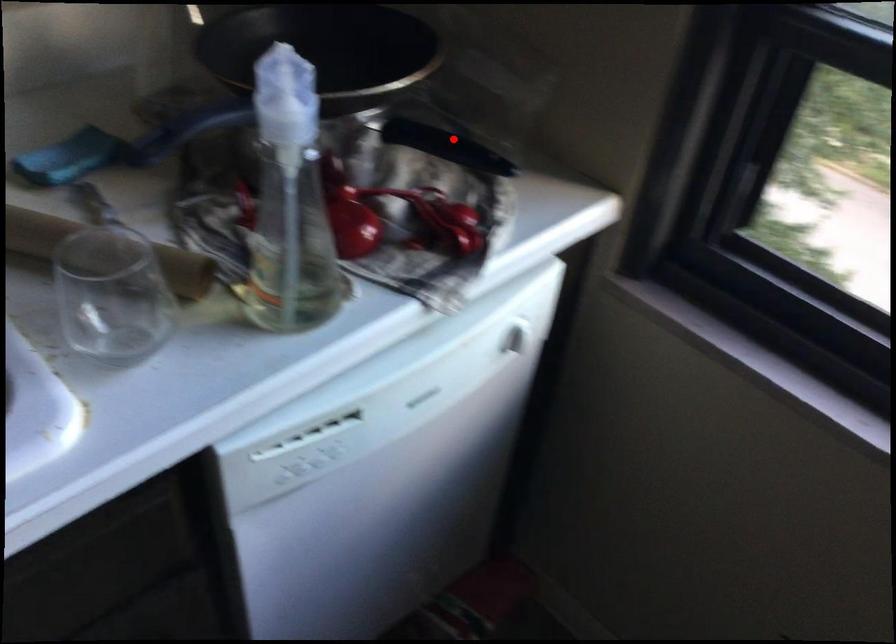
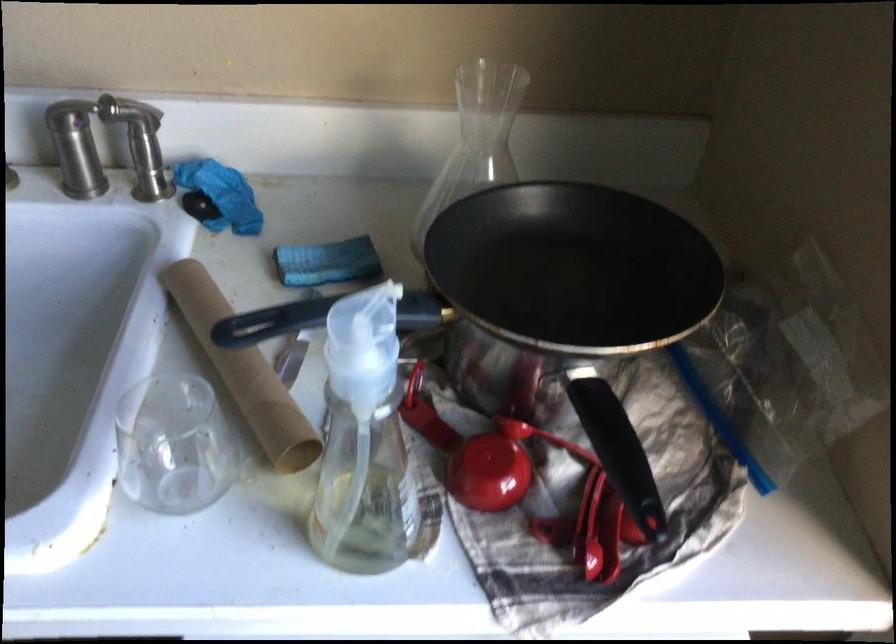
Question: I am providing you with two images of the same scene from different viewpoints. Given a red point in image1, look at the same physical point in image2. Is it:

Choices:
 (A) Closer to the viewpoint
 (B) Farther from the viewpoint

Answer: (A)